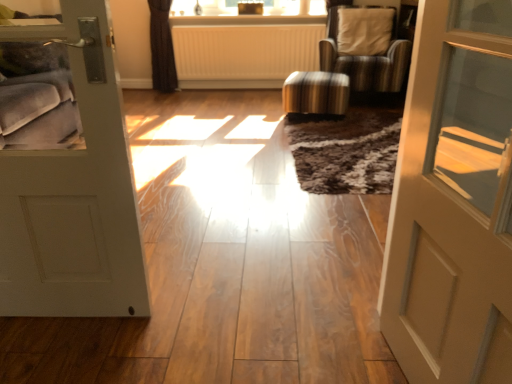
Question: Considering the positions of white ribbed radiator at center and matte beige door at right, marked as the second door in a left-to-right arrangement, in the image, is white ribbed radiator at center taller or shorter than matte beige door at right, marked as the second door in a left-to-right arrangement,?

Choices:
 (A) tall
 (B) short

Answer: (B)

Question: In the image, is white ribbed radiator at center on the left side or the right side of matte beige door at right, marked as the second door in a left-to-right arrangement?

Choices:
 (A) left
 (B) right

Answer: (A)

Question: Considering the real-world distances, which object is farthest from the white matte door at left, the 1th door viewed from the left?

Choices:
 (A) striped fabric stool at center
 (B) matte beige door at right, marked as the second door in a left-to-right arrangement
 (C) white ribbed radiator at center
 (D) striped fabric chair at center

Answer: (D)

Question: Based on their relative distances, which object is nearer to the striped fabric chair at center?

Choices:
 (A) white matte door at left, the 1th door viewed from the left
 (B) striped fabric stool at center
 (C) white ribbed radiator at center
 (D) matte beige door at right, the 1th door in the right-to-left sequence

Answer: (B)